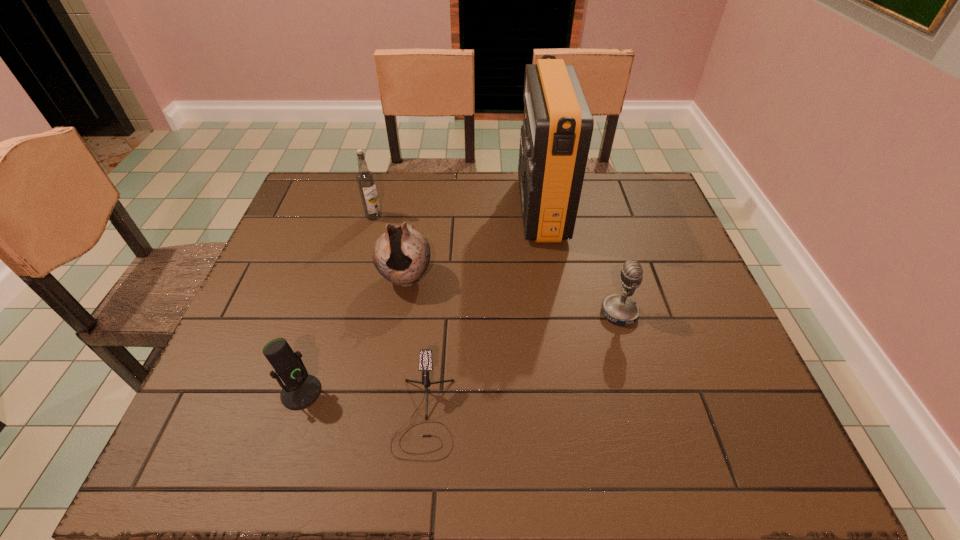
Where is `radio receiver`? This screenshot has height=540, width=960. radio receiver is located at coordinates (555, 138).

I want to click on the tallest object, so click(555, 138).

What are the coordinates of `vodka` in the screenshot? It's located at (365, 178).

What are the coordinates of `pottery` in the screenshot? It's located at [x=401, y=255].

You are a GUI agent. You are given a task and a screenshot of the screen. Output one action in this format:
    pyautogui.click(x=<x>, y=<y>)
    Task: Click on the farthest microphone
    The width and height of the screenshot is (960, 540).
    Given the screenshot: What is the action you would take?
    pyautogui.click(x=619, y=309)

Find the location of a particular element. Image resolution: width=960 pixels, height=540 pixels. the rightmost object is located at coordinates (619, 309).

Identify the location of the leftmost microphone. (301, 389).

This screenshot has width=960, height=540. In order to click on the shortest microphone in this screenshot , I will do `click(425, 355)`.

Locate an element on the screen. This screenshot has height=540, width=960. the second microphone from right to left is located at coordinates (425, 355).

Where is `free region located on the front-facing side of the radio receiver`? free region located on the front-facing side of the radio receiver is located at coordinates 400,208.